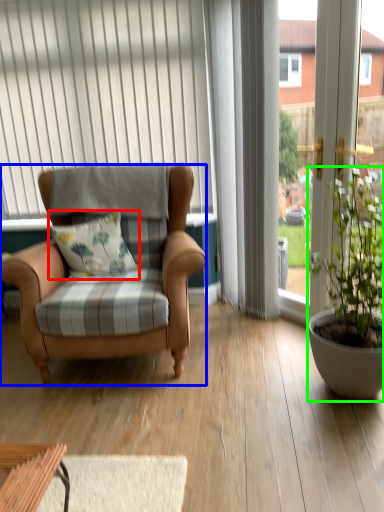
Question: Which is nearer to the pillow (highlighted by a red box)? chair (highlighted by a blue box) or houseplant (highlighted by a green box).

Choices:
 (A) chair
 (B) houseplant

Answer: (A)